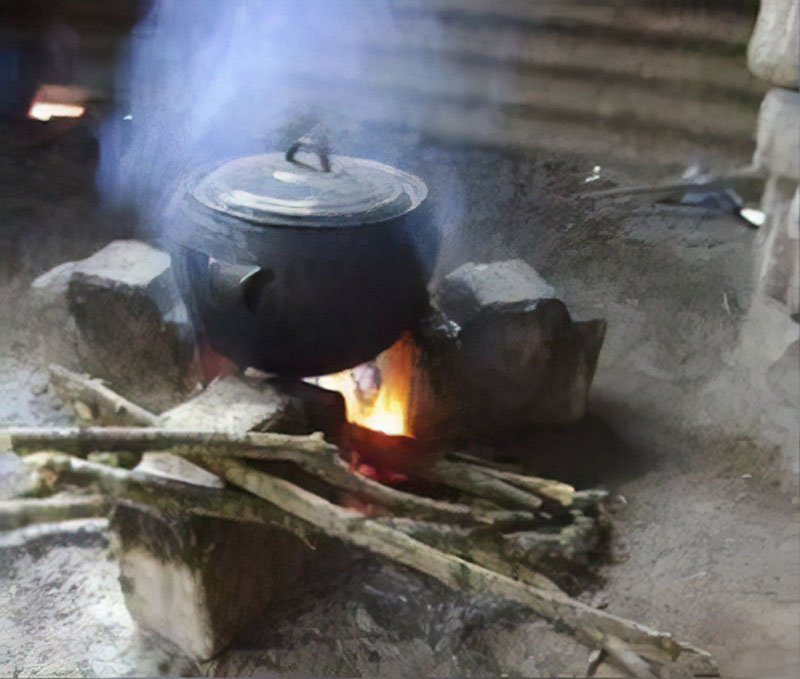
Find the location of a particular element. The width and height of the screenshot is (800, 679). pot lid is located at coordinates (286, 189).